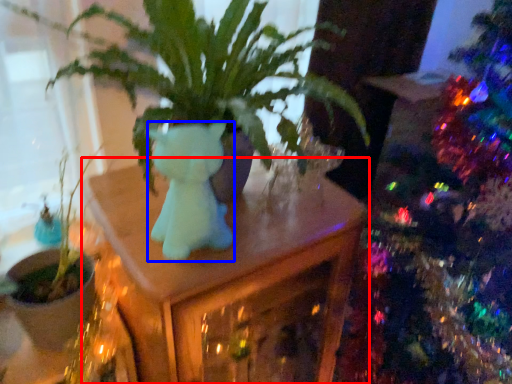
Question: Which object is closer to the camera taking this photo, table (highlighted by a red box) or animal (highlighted by a blue box)?

Choices:
 (A) table
 (B) animal

Answer: (B)